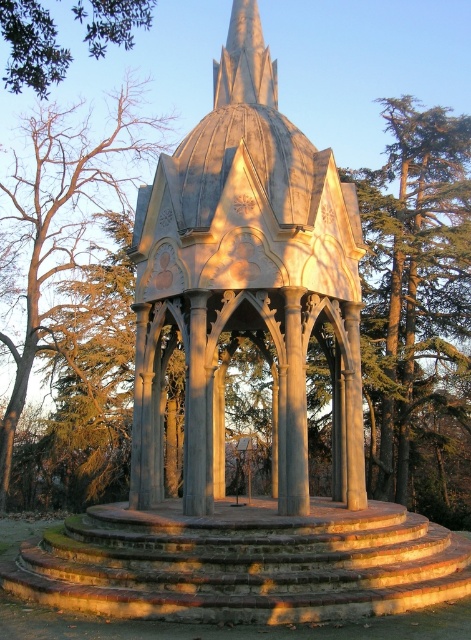
Does stone gazebo at center have a lesser height compared to green leafy tree at upper left?

Yes.

Is stone gazebo at center bigger than green leafy tree at upper left?

Incorrect, stone gazebo at center is not larger than green leafy tree at upper left.

Is point (305, 344) behind point (10, 52)?

No, (305, 344) is closer to viewer.

You are a GUI agent. You are given a task and a screenshot of the screen. Output one action in this format:
    pyautogui.click(x=<x>, y=<y>)
    Task: Click on the stone gazebo at center
    This screenshot has height=640, width=471.
    Given the screenshot: What is the action you would take?
    pyautogui.click(x=245, y=280)

Does green textured tree at right appear on the right side of green leafy tree at upper left?

Correct, you'll find green textured tree at right to the right of green leafy tree at upper left.

Who is more forward, (432, 371) or (66, 49)?

Positioned in front is point (432, 371).

Is point (419, 390) farther from viewer compared to point (15, 65)?

Yes, it is.

Identify the location of green textured tree at right. tap(419, 310).

Which is behind, point (452, 326) or point (59, 164)?

The point (59, 164) is behind.

The height and width of the screenshot is (640, 471). I want to click on green textured tree at right, so click(x=419, y=310).